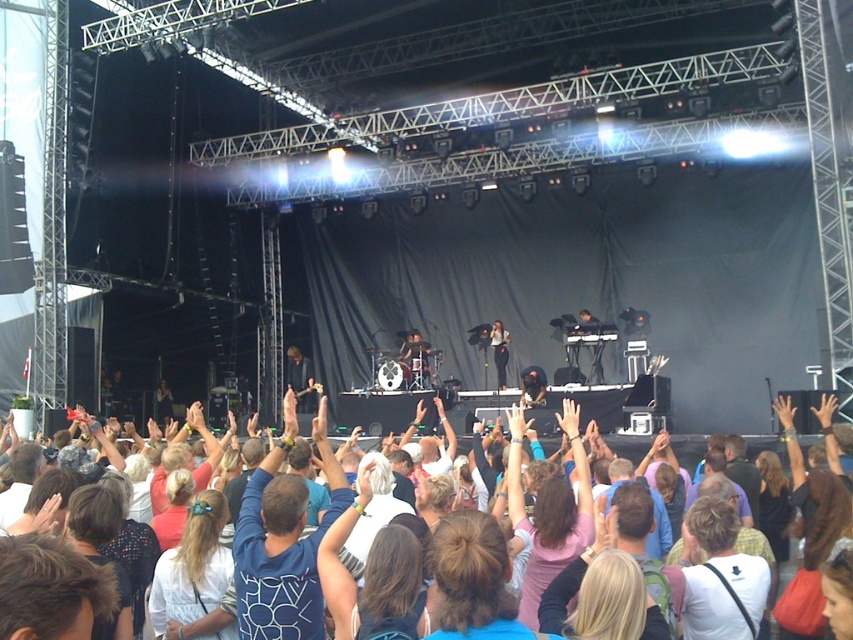
You are a photographer at the concert and want to capture a photo of both the dark blue shirt at center and the matte black dress at center. Since the camera can only focus on one subject at a time, which one should you choose to ensure the subject takes up more space in the photo?

The dark blue shirt at center has a larger width than the matte black dress at center, so choosing to focus on the dark blue shirt at center will ensure the subject takes up more space in the photo.

You are a photographer at the concert and want to capture a photo of both the white cotton crowd at center and the matte black dress at center. Based on their positions, which one would appear closer to the bottom of the photo?

The white cotton crowd at center is located below matte black dress at center, so it would appear closer to the bottom of the photo.